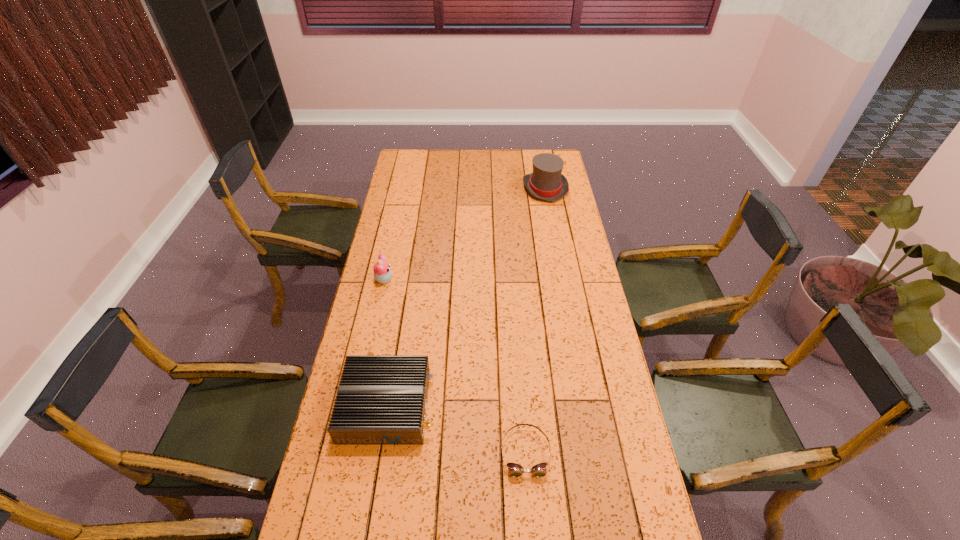
The image size is (960, 540). I want to click on cupcake that is at the left edge, so click(382, 273).

You are a GUI agent. You are given a task and a screenshot of the screen. Output one action in this format:
    pyautogui.click(x=<x>, y=<y>)
    Task: Click on the router located in the left edge section of the desktop
    
    Given the screenshot: What is the action you would take?
    pyautogui.click(x=381, y=400)

Find the location of a particular element. The height and width of the screenshot is (540, 960). object located at the right edge is located at coordinates (546, 182).

Where is `vacant space at the far edge of the desktop`? vacant space at the far edge of the desktop is located at coordinates [x=482, y=173].

Locate an element on the screen. vacant area at the left edge is located at coordinates (404, 224).

The width and height of the screenshot is (960, 540). In order to click on free space at the right edge of the desktop in this screenshot , I will do pyautogui.click(x=568, y=340).

This screenshot has width=960, height=540. In the image, there is a desktop. Identify the location of vacant space at the far left corner. (422, 151).

Locate an element on the screen. vacant region at the far right corner of the desktop is located at coordinates (556, 150).

In order to click on vacant space that is in between the second farthest object and the dress hat in this screenshot , I will do `click(465, 234)`.

Image resolution: width=960 pixels, height=540 pixels. In order to click on free point between the shortest object and the dress hat in this screenshot , I will do `click(535, 320)`.